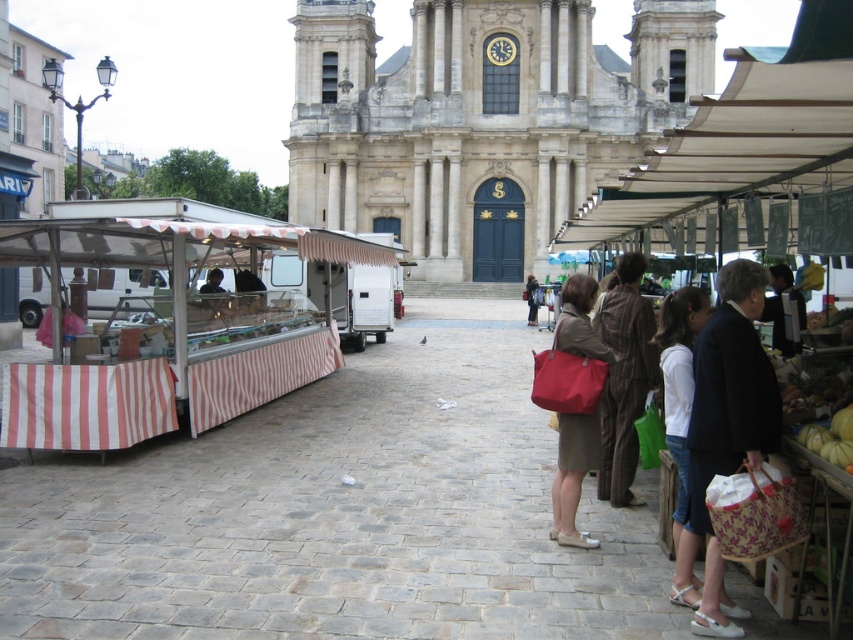
Question: Estimate the real-world distances between objects in this image. Which object is farther from the white striped fabric at left?

Choices:
 (A) matte black jacket at center
 (B) matte red bag at center
 (C) white fabric bag at center
 (D) stone church at center

Answer: (C)

Question: Does matte red bag at center appear under matte black jacket at center?

Choices:
 (A) no
 (B) yes

Answer: (B)

Question: Is stone church at center wider than white striped fabric at left?

Choices:
 (A) no
 (B) yes

Answer: (B)

Question: Based on their relative distances, which object is nearer to the matte black jacket at center?

Choices:
 (A) white fabric bag at center
 (B) white striped fabric at left

Answer: (A)

Question: Can you confirm if stone church at center is wider than white striped fabric at left?

Choices:
 (A) yes
 (B) no

Answer: (A)

Question: Which point is closer to the camera?

Choices:
 (A) white striped fabric at left
 (B) matte red bag at center

Answer: (B)